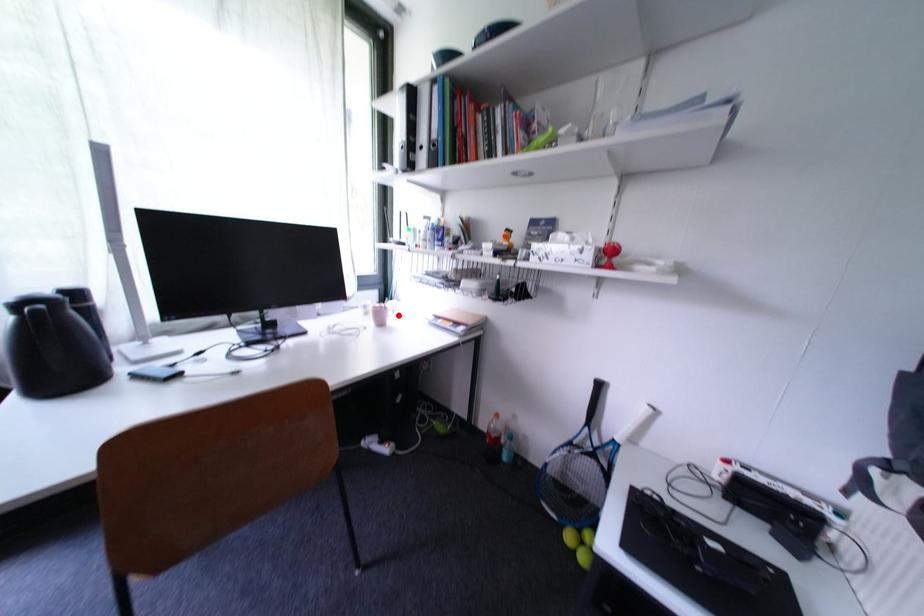
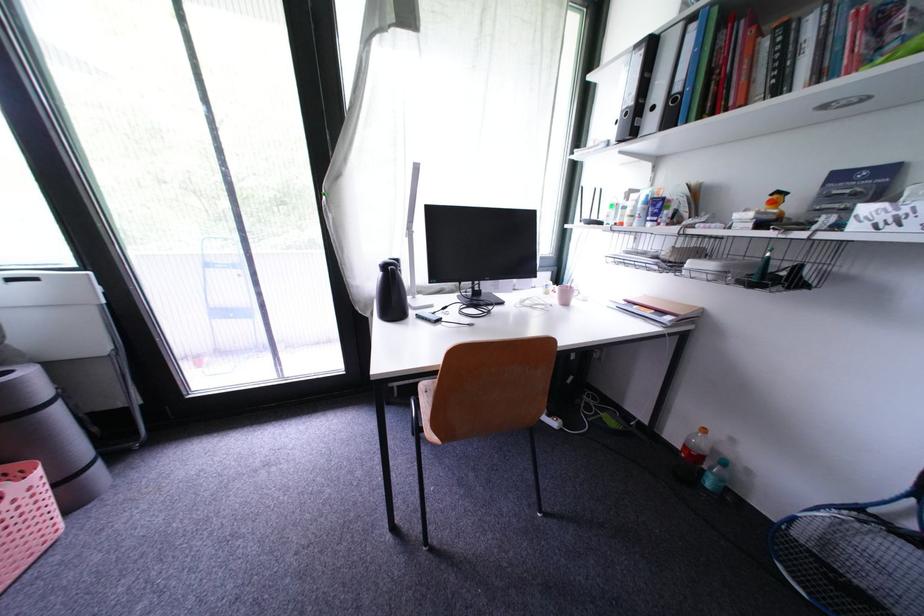
Locate, in the second image, the point that corresponds to the highlighted location in the first image.

(584, 296)